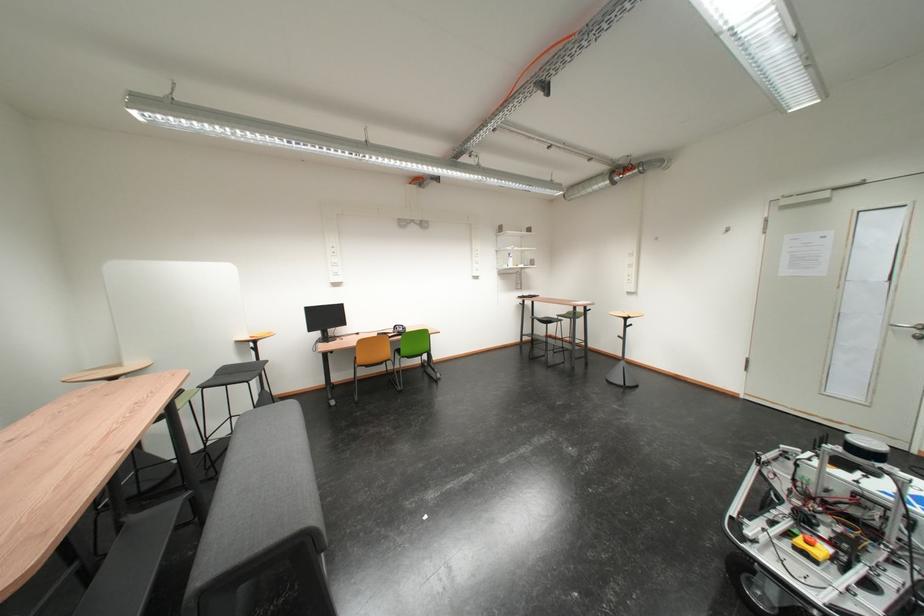
What are the coordinates of `grey sofa surface` in the screenshot? It's located at (261, 515).